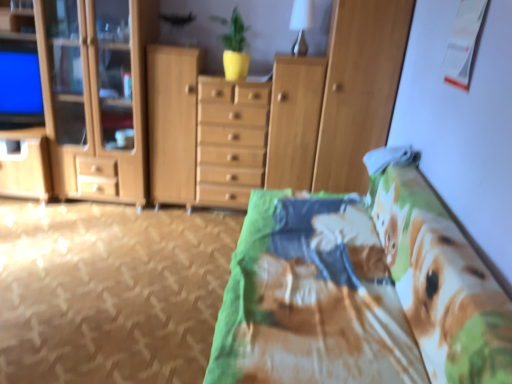
Measure the distance between point (65, 153) and camera.

They are 3.01 meters apart.

The width and height of the screenshot is (512, 384). What do you see at coordinates (229, 129) in the screenshot?
I see `wooden cabinet at center` at bounding box center [229, 129].

I want to click on printed fabric bed at center, so click(360, 291).

The image size is (512, 384). Find the location of `wooden cabinet at left, which ranks as the 1th cabinetry in left-to-right order`. wooden cabinet at left, which ranks as the 1th cabinetry in left-to-right order is located at coordinates (97, 97).

Between printed fabric bed at center and wooden cabinet at center, which one has smaller width?

wooden cabinet at center is thinner.

How far apart are printed fabric bed at center and wooden cabinet at center?

printed fabric bed at center is 3.32 feet away from wooden cabinet at center.

Identify the location of bed on the right of wooden cabinet at center. (360, 291).

In the image, is wooden cabinet at left, which ranks as the 1th cabinetry in left-to-right order, positioned in front of or behind printed fabric bed at center?

Clearly, wooden cabinet at left, which ranks as the 1th cabinetry in left-to-right order, is behind printed fabric bed at center.

Between wooden cabinet at left, which ranks as the 1th cabinetry in left-to-right order, and printed fabric bed at center, which one has smaller size?

Smaller between the two is wooden cabinet at left, which ranks as the 1th cabinetry in left-to-right order.

Considering the sizes of objects wooden cabinet at left, which ranks as the 1th cabinetry in left-to-right order, and printed fabric bed at center in the image provided, who is wider, wooden cabinet at left, which ranks as the 1th cabinetry in left-to-right order, or printed fabric bed at center?

With larger width is printed fabric bed at center.

Does point (111, 193) appear closer or farther from the camera than point (258, 330)?

Point (111, 193) appears to be farther away from the viewer than point (258, 330).

Is printed fabric bed at center aimed at wooden cabinet at left, which ranks as the 1th cabinetry in left-to-right order?

Yes.

Is point (356, 371) closer to camera compared to point (88, 33)?

Yes, it is in front of point (88, 33).

Who is shorter, printed fabric bed at center or wooden cabinet at left, which ranks as the 1th cabinetry in left-to-right order?

Standing shorter between the two is printed fabric bed at center.

How distant is printed fabric bed at center from wooden cabinet at left, which ranks as the second cabinetry in right-to-left order?

printed fabric bed at center is 5.36 feet from wooden cabinet at left, which ranks as the second cabinetry in right-to-left order.

Based on the photo, is wooden cabinet at center, the second cabinetry positioned from the left, aimed at wooden cabinet at left, which ranks as the 1th cabinetry in left-to-right order?

No.

How far apart are wooden cabinet at center, the first cabinetry from the right, and wooden cabinet at left, which ranks as the 1th cabinetry in left-to-right order?

wooden cabinet at center, the first cabinetry from the right, is 4.92 feet from wooden cabinet at left, which ranks as the 1th cabinetry in left-to-right order.

Can you confirm if wooden cabinet at center, the first cabinetry from the right, is positioned to the left of wooden cabinet at left, which ranks as the second cabinetry in right-to-left order?

Incorrect, wooden cabinet at center, the first cabinetry from the right, is not on the left side of wooden cabinet at left, which ranks as the second cabinetry in right-to-left order.

Would you say wooden cabinet at left, which ranks as the 1th cabinetry in left-to-right order, is part of wooden cabinet at center, the first cabinetry from the right,'s contents?

Actually, wooden cabinet at left, which ranks as the 1th cabinetry in left-to-right order, is outside wooden cabinet at center, the first cabinetry from the right.

Where is `cabinetry that appears on the left of wooden cabinet at center`? This screenshot has width=512, height=384. cabinetry that appears on the left of wooden cabinet at center is located at coordinates (97, 97).

Does wooden cabinet at left, which ranks as the second cabinetry in right-to-left order, contain wooden cabinet at center?

No, wooden cabinet at center is not surrounded by wooden cabinet at left, which ranks as the second cabinetry in right-to-left order.

Considering the positions of objects wooden cabinet at left, which ranks as the 1th cabinetry in left-to-right order, and wooden cabinet at center in the image provided, who is more to the right, wooden cabinet at left, which ranks as the 1th cabinetry in left-to-right order, or wooden cabinet at center?

Positioned to the right is wooden cabinet at center.

Who is shorter, wooden cabinet at left, which ranks as the 1th cabinetry in left-to-right order, or wooden cabinet at center?

With less height is wooden cabinet at center.

In terms of height, does wooden cabinet at center look taller or shorter compared to wooden cabinet at left, which ranks as the second cabinetry in right-to-left order?

Considering their sizes, wooden cabinet at center has less height than wooden cabinet at left, which ranks as the second cabinetry in right-to-left order.

Considering the relative sizes of wooden cabinet at center and wooden cabinet at left, which ranks as the 1th cabinetry in left-to-right order, in the image provided, is wooden cabinet at center smaller than wooden cabinet at left, which ranks as the 1th cabinetry in left-to-right order,?

Correct, wooden cabinet at center occupies less space than wooden cabinet at left, which ranks as the 1th cabinetry in left-to-right order.

Which object is thinner, wooden cabinet at center or wooden cabinet at left, which ranks as the 1th cabinetry in left-to-right order?

wooden cabinet at center is thinner.

From the image's perspective, is wooden cabinet at center, the first cabinetry from the right, on top of printed fabric bed at center?

Yes, from the image's perspective, wooden cabinet at center, the first cabinetry from the right, is on top of printed fabric bed at center.

Is wooden cabinet at center, the first cabinetry from the right, at the left side of printed fabric bed at center?

Incorrect, wooden cabinet at center, the first cabinetry from the right, is not on the left side of printed fabric bed at center.

Considering the sizes of objects wooden cabinet at center, the first cabinetry from the right, and printed fabric bed at center in the image provided, who is shorter, wooden cabinet at center, the first cabinetry from the right, or printed fabric bed at center?

printed fabric bed at center.

Identify the location of cupboard on the left of printed fabric bed at center. (229, 129).

The width and height of the screenshot is (512, 384). In order to click on bed lying below the wooden cabinet at left, which ranks as the 1th cabinetry in left-to-right order (from the image's perspective) in this screenshot , I will do `click(360, 291)`.

Considering their positions, is printed fabric bed at center positioned closer to wooden cabinet at left, which ranks as the second cabinetry in right-to-left order, than wooden cabinet at center, the first cabinetry from the right?

wooden cabinet at center, the first cabinetry from the right.

Looking at the image, which one is located closer to wooden cabinet at center, wooden cabinet at center, the second cabinetry positioned from the left, or wooden cabinet at left, which ranks as the second cabinetry in right-to-left order?

Answer: wooden cabinet at center, the second cabinetry positioned from the left, is closer to wooden cabinet at center.

When comparing their distances from wooden cabinet at center, the second cabinetry positioned from the left, does wooden cabinet at left, which ranks as the second cabinetry in right-to-left order, or wooden cabinet at center seem closer?

wooden cabinet at center.

From the image, which object appears to be farther from wooden cabinet at center, the second cabinetry positioned from the left, printed fabric bed at center or wooden cabinet at left, which ranks as the second cabinetry in right-to-left order?

wooden cabinet at left, which ranks as the second cabinetry in right-to-left order, is positioned further to the anchor wooden cabinet at center, the second cabinetry positioned from the left.

When comparing their distances from wooden cabinet at center, the second cabinetry positioned from the left, does wooden cabinet at left, which ranks as the second cabinetry in right-to-left order, or printed fabric bed at center seem closer?

printed fabric bed at center is closer to wooden cabinet at center, the second cabinetry positioned from the left.

Looking at the image, which one is located closer to printed fabric bed at center, wooden cabinet at center or wooden cabinet at center, the first cabinetry from the right?

Based on the image, wooden cabinet at center, the first cabinetry from the right, appears to be nearer to printed fabric bed at center.

When comparing their distances from printed fabric bed at center, does wooden cabinet at center, the first cabinetry from the right, or wooden cabinet at center seem further?

wooden cabinet at center is positioned further to the anchor printed fabric bed at center.

Based on their spatial positions, is wooden cabinet at center, the first cabinetry from the right, or printed fabric bed at center closer to wooden cabinet at left, which ranks as the second cabinetry in right-to-left order?

wooden cabinet at center, the first cabinetry from the right, lies closer to wooden cabinet at left, which ranks as the second cabinetry in right-to-left order, than the other object.

The width and height of the screenshot is (512, 384). Identify the location of cupboard between wooden cabinet at left, which ranks as the second cabinetry in right-to-left order, and wooden cabinet at center, the first cabinetry from the right, from left to right. (229, 129).

The image size is (512, 384). Identify the location of bed between wooden cabinet at left, which ranks as the 1th cabinetry in left-to-right order, and wooden cabinet at center, the first cabinetry from the right, in the horizontal direction. 360,291.